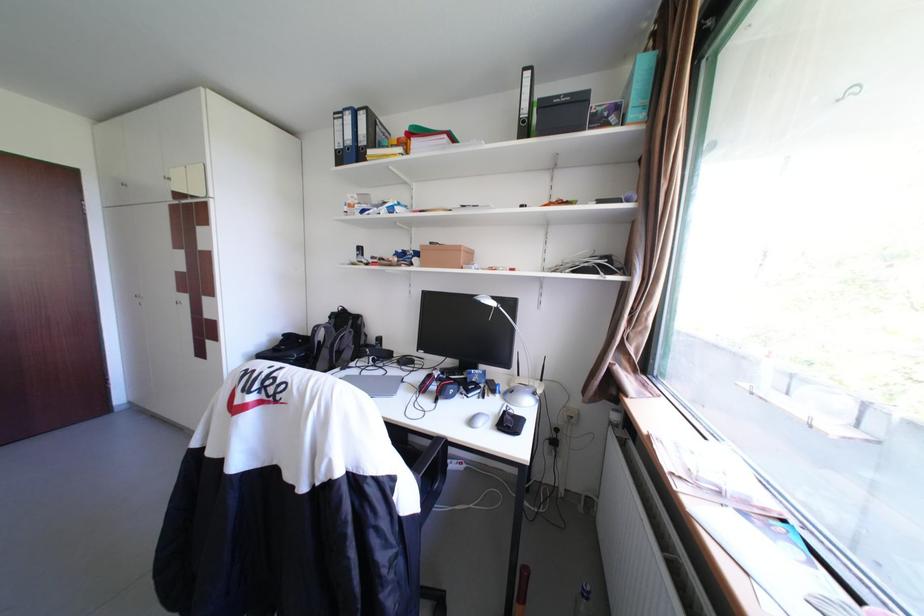
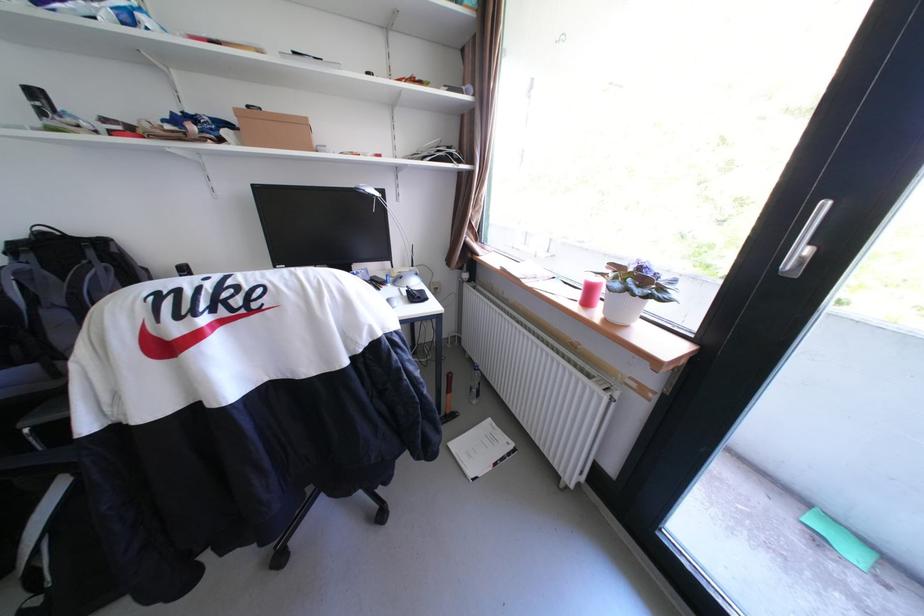
In the second image, find the point that corresponds to (516,411) in the first image.

(418, 291)